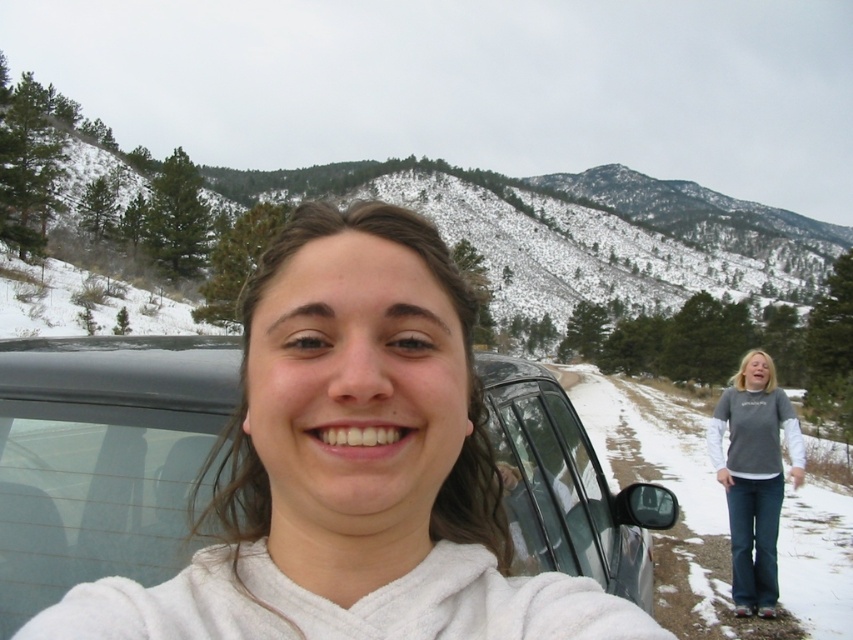
You are a photographer trying to capture the two people in the snowy scene. The metallic gray car at center and the transparent glass car window at center are blocking your view. Which object should you move to get a clear shot of both individuals?

You should move the metallic gray car at center because it is positioned on the left side of the transparent glass car window at center, meaning it is closer to the photographer and blocking the view more directly.

You are standing at the point marked as point (102, 458) in the image. What object is located exactly at that point?

The metallic gray car at center is located exactly at point (102, 458).

You are a photographer trying to capture a wide shot of the metallic gray car at center and the snowy forested mountain at upper center. Based on their sizes in the image, which object would appear narrower in the photo?

The metallic gray car at center appears narrower in the photo than the snowy forested mountain at upper center because it is thinner.